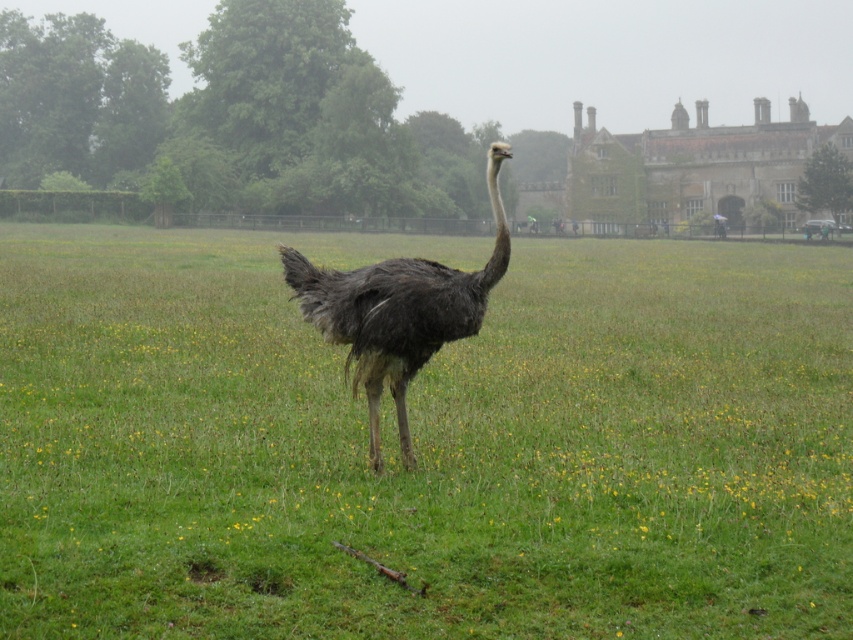
You are standing at the point marked as point [422,444] in the image. What is the immediate surface you are standing on?

The immediate surface at point [422,444] is the green grassy field at center.

You are a birdwatcher trying to spot the dark gray feathers ostrich at center from a distance. Considering the green grassy field at center is taller than the ostrich, would the ostrich be easily visible from above?

The green grassy field at center has a greater height compared to the dark gray feathers ostrich at center, so the ostrich might be partially hidden by the tall grass and not easily visible from above.

You are an ornithologist observing the dark gray feathers ostrich at center and the green grassy field at center from a distance. Which object is positioned more to the right in the image?

The green grassy field at center is to the right of the dark gray feathers ostrich at center, so the green grassy field at center is positioned more to the right.